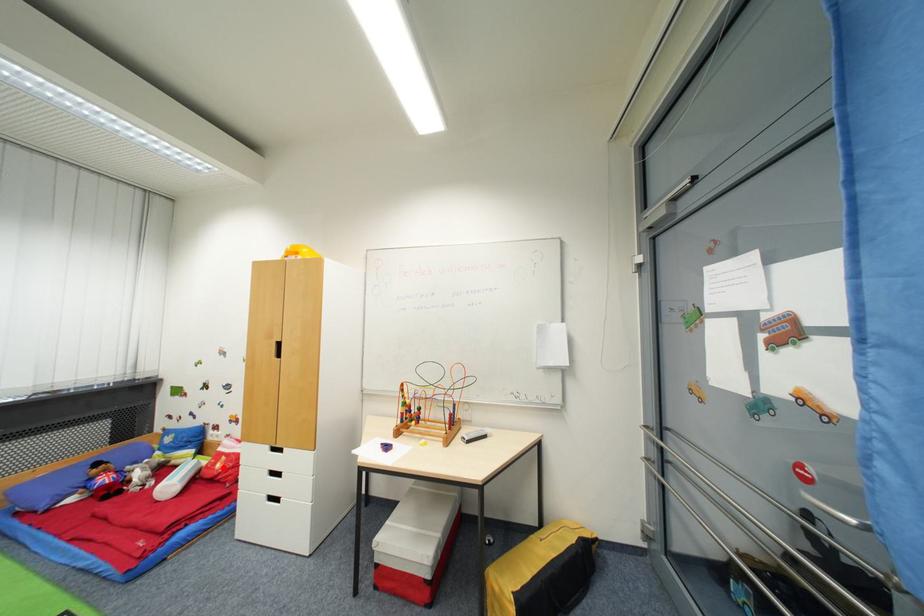
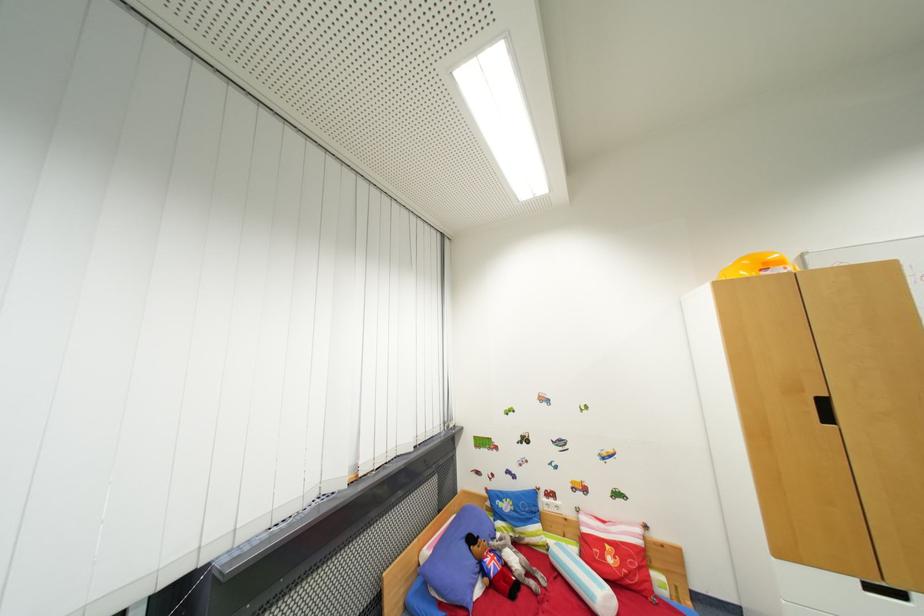
Where in the second image is the point corresponding to the highlighted location from the first image?

(614, 562)